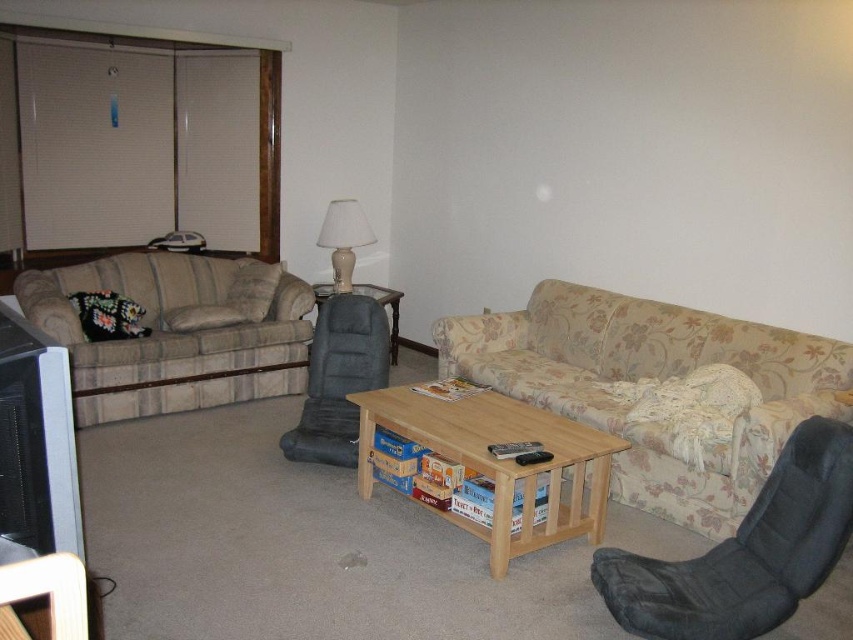
Who is higher up, floral fabric couch at center or plaid fabric couch at left?

plaid fabric couch at left

Can you confirm if floral fabric couch at center is bigger than plaid fabric couch at left?

Yes, floral fabric couch at center is bigger than plaid fabric couch at left.

This screenshot has height=640, width=853. What do you see at coordinates (653, 378) in the screenshot?
I see `floral fabric couch at center` at bounding box center [653, 378].

Locate an element on the screen. Image resolution: width=853 pixels, height=640 pixels. floral fabric couch at center is located at coordinates (653, 378).

Is black fabric swivel chair at lower right behind dark gray plush armchair at center?

No, black fabric swivel chair at lower right is closer to the viewer.

Does black fabric swivel chair at lower right have a lesser height compared to dark gray plush armchair at center?

Yes.

Which is in front, point (813, 484) or point (347, 461)?

Point (813, 484) is in front.

Identify the location of black fabric swivel chair at lower right. (746, 552).

Can you confirm if light brown wooden coffee table at center is positioned below matte gray side table at center?

Indeed, light brown wooden coffee table at center is positioned under matte gray side table at center.

What do you see at coordinates (498, 461) in the screenshot?
I see `light brown wooden coffee table at center` at bounding box center [498, 461].

Which is behind, point (396, 428) or point (366, 292)?

Point (366, 292)

What are the coordinates of `light brown wooden coffee table at center` in the screenshot? It's located at (498, 461).